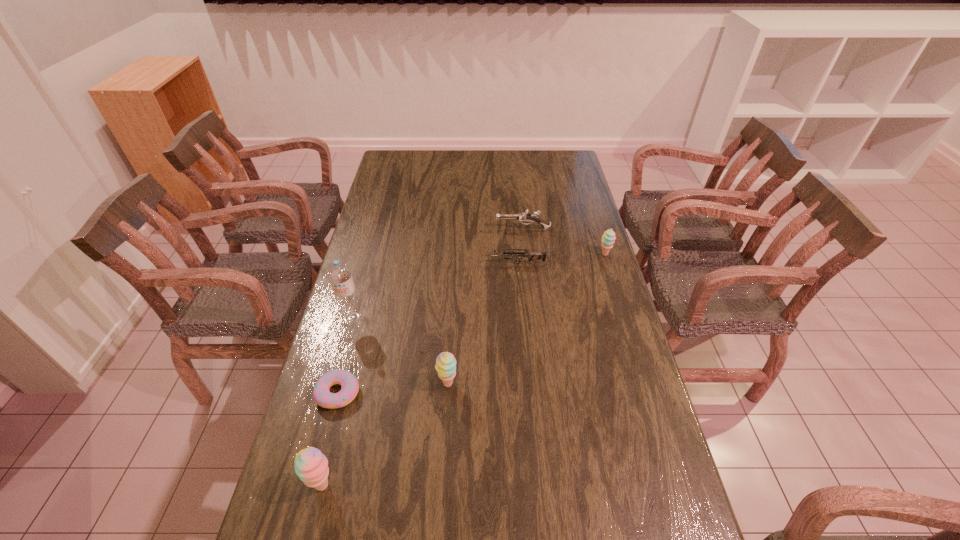
Find the location of a particular element. Image resolution: width=960 pixels, height=540 pixels. free space at the far edge of the desktop is located at coordinates (428, 160).

In the image, there is a desktop. Identify the location of vacant space at the right edge. (x=564, y=186).

Locate an element on the screen. Image resolution: width=960 pixels, height=540 pixels. free spot at the far left corner of the desktop is located at coordinates (395, 153).

In the image, there is a desktop. At what (x,y) coordinates should I click in order to perform the action: click on vacant space at the near left corner. Please return your answer as a coordinate pair (x, y). The height and width of the screenshot is (540, 960). Looking at the image, I should click on (279, 536).

Identify the location of empty location between the shortest object and the second farthest object. The width and height of the screenshot is (960, 540). (471, 323).

This screenshot has height=540, width=960. I want to click on vacant area between the farther gun and the second shortest object, so tap(519, 246).

The image size is (960, 540). Identify the location of free space between the second farthest object and the farthest object. [x=564, y=241].

Where is `free area in between the sixth nearest object and the farther gun`? The width and height of the screenshot is (960, 540). free area in between the sixth nearest object and the farther gun is located at coordinates (564, 241).

You are a GUI agent. You are given a task and a screenshot of the screen. Output one action in this format:
    pyautogui.click(x=<x>, y=<y>)
    Task: Click on the blank region between the water bottle and the fifth nearest object
    Image resolution: width=960 pixels, height=540 pixels.
    Given the screenshot: What is the action you would take?
    pyautogui.click(x=434, y=291)

You are a GUI agent. You are given a task and a screenshot of the screen. Output one action in this format:
    pyautogui.click(x=<x>, y=<y>)
    Task: Click on the free space between the tallest object and the farthest object
    
    Given the screenshot: What is the action you would take?
    [438, 273]